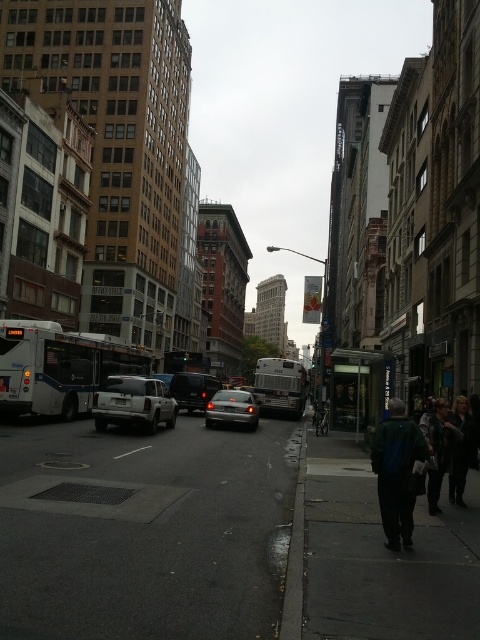
You are a delivery person needing to park your silver metallic sedan at center near the pedestrian area where the green fabric jacket at lower right is walking. Considering the distance between them, is there enough space for you to safely park your car without blocking the pedestrian path?

The green fabric jacket at lower right is 57.71 feet away from the silver metallic sedan at center. Since the distance is quite large, there should be sufficient space to park the silver metallic sedan at center without obstructing the pedestrian path near the green fabric jacket at lower right.

In the scene shown: You are a pedestrian standing on the sidewalk looking straight ahead. You see the gray asphalt at lower left and the dark green jacket at lower right. Which object is positioned more to the left side of the scene?

The gray asphalt at lower left is positioned more to the left side of the scene than the dark green jacket at lower right.

You are standing on the street and want to take a photo that includes both point (168, 436) and point (447, 426). Since you want both points to be in focus, which point should you focus on to ensure the other is also sharp?

You should focus on point (447, 426) because it is closer to the camera than point (168, 436). By focusing on the closer point, the farther point will also be within the depth of field.